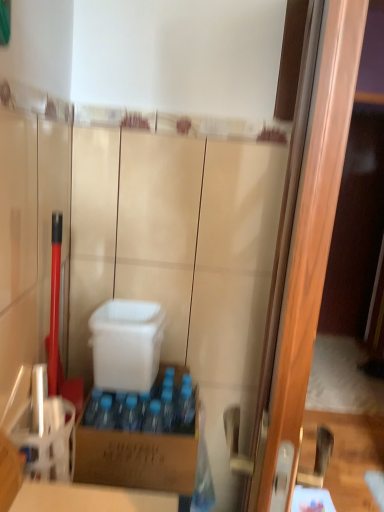
Question: Can you confirm if wooden screen door at right is positioned to the left of white plastic container at center, which is counted as the 1th box, starting from the top?

Choices:
 (A) no
 (B) yes

Answer: (A)

Question: From the image's perspective, would you say wooden screen door at right is positioned over white plastic container at center, which is counted as the 1th box, starting from the top?

Choices:
 (A) yes
 (B) no

Answer: (A)

Question: From the image's perspective, is wooden screen door at right below white plastic container at center, which ranks as the 2th box in bottom-to-top order?

Choices:
 (A) yes
 (B) no

Answer: (B)

Question: Is wooden screen door at right not inside white plastic container at center, which is counted as the 1th box, starting from the top?

Choices:
 (A) no
 (B) yes

Answer: (B)

Question: Is wooden screen door at right closer to the viewer compared to white plastic container at center, which is counted as the 1th box, starting from the top?

Choices:
 (A) no
 (B) yes

Answer: (B)

Question: From a real-world perspective, is wooden screen door at right positioned under white plastic container at center, which is counted as the 1th box, starting from the top, based on gravity?

Choices:
 (A) no
 (B) yes

Answer: (A)

Question: From the image's perspective, is brown cardboard box at center, placed as the 1th box when sorted from bottom to top, located above white plastic container at center, which ranks as the 2th box in bottom-to-top order?

Choices:
 (A) no
 (B) yes

Answer: (A)

Question: Is brown cardboard box at center, placed as the 1th box when sorted from bottom to top, oriented away from white plastic container at center, which ranks as the 2th box in bottom-to-top order?

Choices:
 (A) no
 (B) yes

Answer: (A)

Question: Is brown cardboard box at center, placed as the 1th box when sorted from bottom to top, at the right side of white plastic container at center, which ranks as the 2th box in bottom-to-top order?

Choices:
 (A) yes
 (B) no

Answer: (A)

Question: Is brown cardboard box at center, placed as the 1th box when sorted from bottom to top, with white plastic container at center, which is counted as the 1th box, starting from the top?

Choices:
 (A) no
 (B) yes

Answer: (A)

Question: From a real-world perspective, is brown cardboard box at center, placed as the 1th box when sorted from bottom to top, on white plastic container at center, which ranks as the 2th box in bottom-to-top order?

Choices:
 (A) yes
 (B) no

Answer: (B)

Question: Is there a large distance between brown cardboard box at center, placed as the 1th box when sorted from bottom to top, and white plastic container at center, which ranks as the 2th box in bottom-to-top order?

Choices:
 (A) no
 (B) yes

Answer: (A)

Question: From a real-world perspective, is white plastic container at center, which ranks as the 2th box in bottom-to-top order, located higher than wooden screen door at right?

Choices:
 (A) yes
 (B) no

Answer: (B)